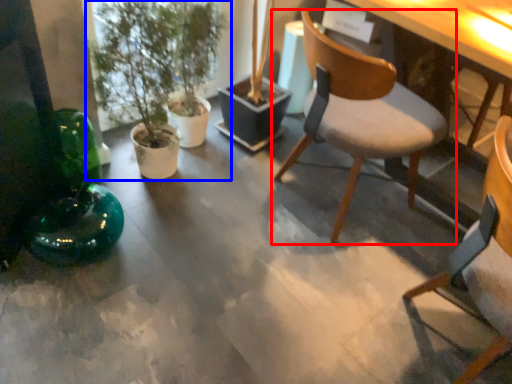
Question: Which point is closer to the camera, chair (highlighted by a red box) or houseplant (highlighted by a blue box)?

Choices:
 (A) chair
 (B) houseplant

Answer: (A)